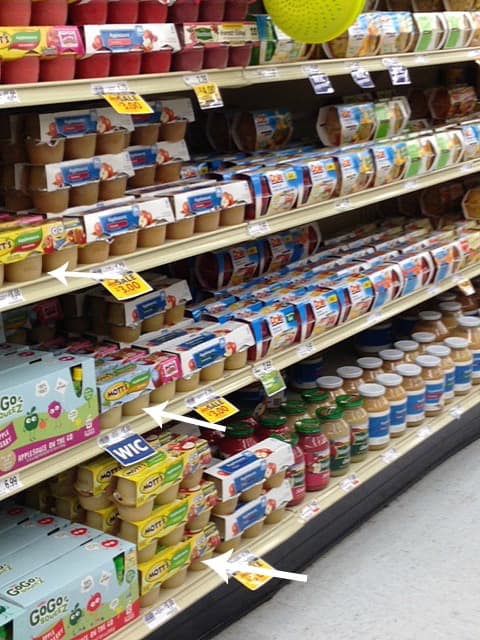
You are a GUI agent. You are given a task and a screenshot of the screen. Output one action in this format:
    pyautogui.click(x=<x>, y=<y>)
    Task: Click on the bottom/baseboard of shelves
    This screenshot has height=640, width=480.
    Given the screenshot: What is the action you would take?
    pyautogui.click(x=358, y=507)